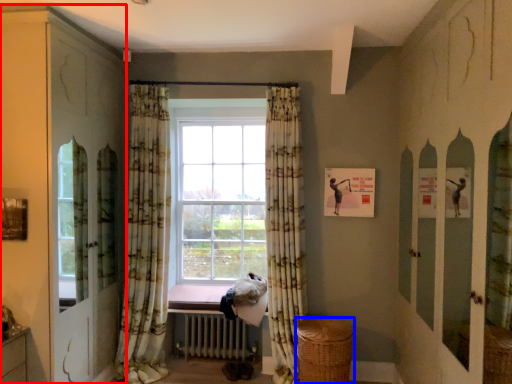
Question: Which object appears farthest to the camera in this image, dresser (highlighted by a red box) or basket (highlighted by a blue box)?

Choices:
 (A) dresser
 (B) basket

Answer: (B)